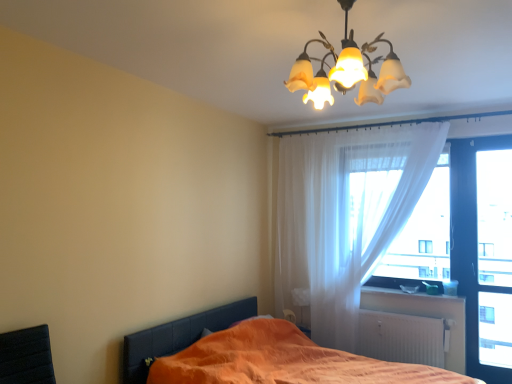
Question: Is transparent glass door at right, the 1th window screen positioned from the right, with translucent glass chandelier at upper center?

Choices:
 (A) no
 (B) yes

Answer: (A)

Question: Is transparent glass door at right, marked as the 2th window screen in a left-to-right arrangement, aimed at translucent glass chandelier at upper center?

Choices:
 (A) no
 (B) yes

Answer: (A)

Question: Considering the relative sizes of transparent glass door at right, marked as the 2th window screen in a left-to-right arrangement, and translucent glass chandelier at upper center in the image provided, is transparent glass door at right, marked as the 2th window screen in a left-to-right arrangement, shorter than translucent glass chandelier at upper center?

Choices:
 (A) yes
 (B) no

Answer: (B)

Question: Is transparent glass door at right, marked as the 2th window screen in a left-to-right arrangement, taller than translucent glass chandelier at upper center?

Choices:
 (A) no
 (B) yes

Answer: (B)

Question: From a real-world perspective, is transparent glass door at right, the 1th window screen positioned from the right, on translucent glass chandelier at upper center?

Choices:
 (A) yes
 (B) no

Answer: (B)

Question: From the image's perspective, is transparent glass door at right, marked as the 2th window screen in a left-to-right arrangement, over translucent glass chandelier at upper center?

Choices:
 (A) no
 (B) yes

Answer: (A)

Question: Does translucent fabric at right, placed as the first window screen when sorted from left to right, appear on the left side of orange fabric bed at lower left?

Choices:
 (A) no
 (B) yes

Answer: (A)

Question: Is translucent fabric at right, arranged as the second window screen when viewed from the right, positioned behind orange fabric bed at lower left?

Choices:
 (A) no
 (B) yes

Answer: (B)

Question: Is translucent fabric at right, placed as the first window screen when sorted from left to right, aimed at orange fabric bed at lower left?

Choices:
 (A) no
 (B) yes

Answer: (B)

Question: From a real-world perspective, is translucent fabric at right, arranged as the second window screen when viewed from the right, located higher than orange fabric bed at lower left?

Choices:
 (A) yes
 (B) no

Answer: (A)

Question: Is translucent fabric at right, arranged as the second window screen when viewed from the right, at the right side of orange fabric bed at lower left?

Choices:
 (A) yes
 (B) no

Answer: (A)

Question: Is translucent fabric at right, arranged as the second window screen when viewed from the right, looking in the opposite direction of orange fabric bed at lower left?

Choices:
 (A) no
 (B) yes

Answer: (A)

Question: Is translucent white curtain at upper right positioned beyond the bounds of white plastic window sill at lower right?

Choices:
 (A) no
 (B) yes

Answer: (B)